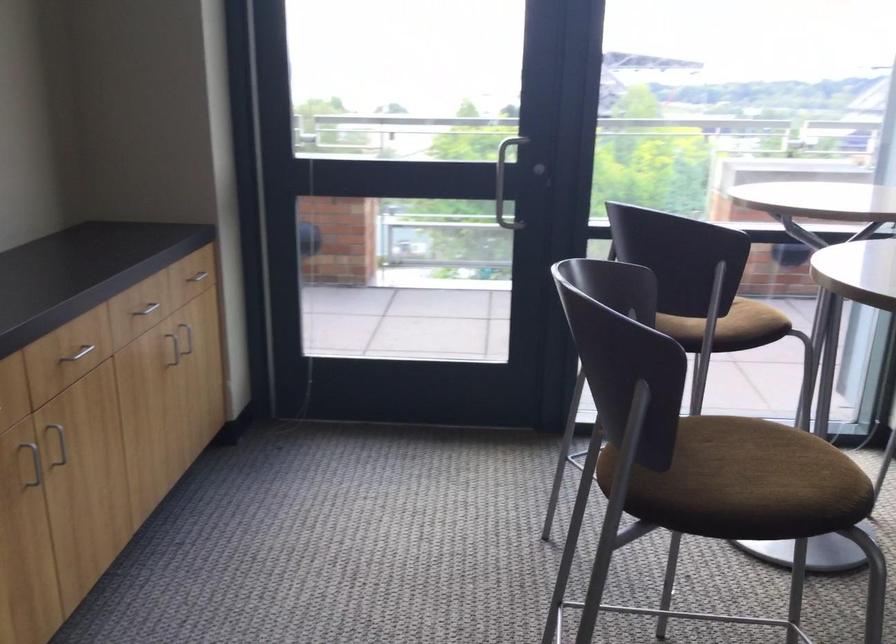
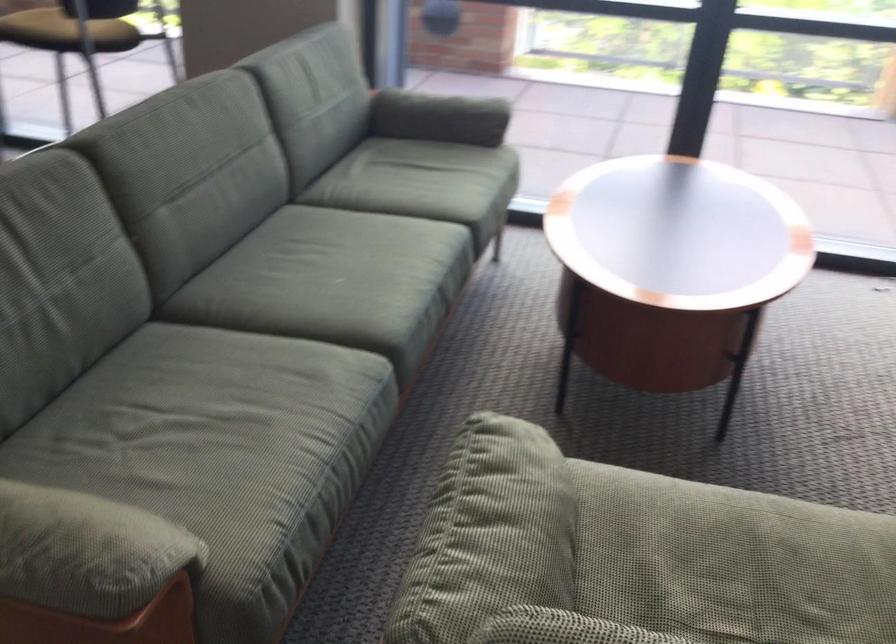
Question: In a continuous first-person perspective shot, in which direction is the camera moving?

Choices:
 (A) Left
 (B) Right
 (C) Forward
 (D) Backward

Answer: (B)